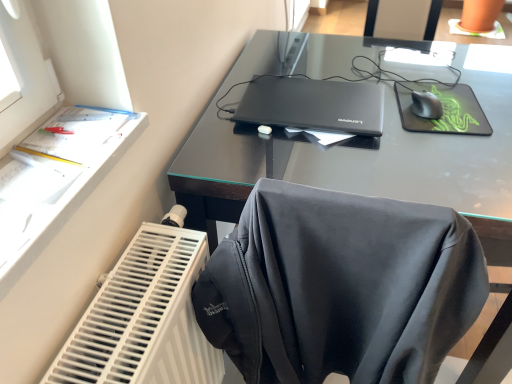
What are the coordinates of `free space in front of green matte mousepad at upper right` in the screenshot? It's located at (442, 155).